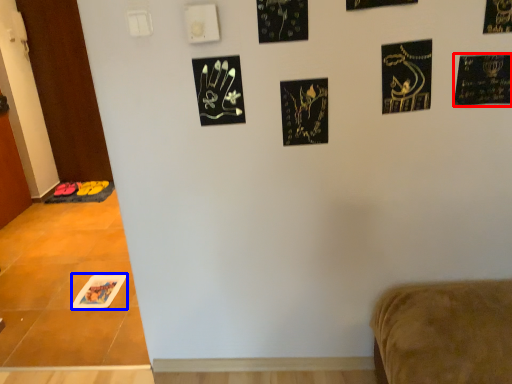
Question: Which of the following is the closest to the observer, postcard (highlighted by a red box) or print (highlighted by a blue box)?

Choices:
 (A) postcard
 (B) print

Answer: (A)